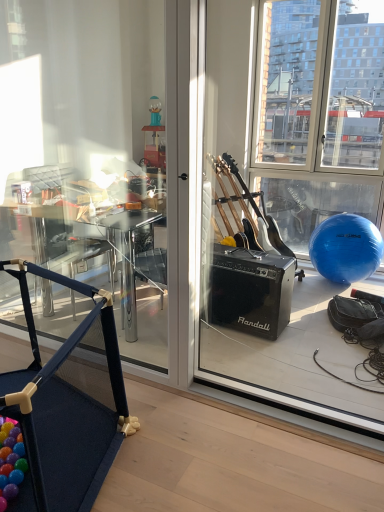
Question: Can you confirm if transparent glass window screen at right is smaller than blue fabric playpen at lower left?

Choices:
 (A) no
 (B) yes

Answer: (B)

Question: Is transparent glass window screen at right oriented towards blue fabric playpen at lower left?

Choices:
 (A) no
 (B) yes

Answer: (A)

Question: From a real-world perspective, does transparent glass window screen at right stand above blue fabric playpen at lower left?

Choices:
 (A) no
 (B) yes

Answer: (B)

Question: From the image's perspective, would you say transparent glass window screen at right is positioned over blue fabric playpen at lower left?

Choices:
 (A) yes
 (B) no

Answer: (A)

Question: Is transparent glass window screen at right positioned with its back to blue fabric playpen at lower left?

Choices:
 (A) yes
 (B) no

Answer: (B)

Question: Is point (82, 370) positioned closer to the camera than point (39, 397)?

Choices:
 (A) closer
 (B) farther

Answer: (B)

Question: From the image's perspective, is wooden floor at lower left positioned above or below blue fabric playpen at lower left?

Choices:
 (A) below
 (B) above

Answer: (A)

Question: In terms of height, does wooden floor at lower left look taller or shorter compared to blue fabric playpen at lower left?

Choices:
 (A) short
 (B) tall

Answer: (A)

Question: In terms of width, does wooden floor at lower left look wider or thinner when compared to blue fabric playpen at lower left?

Choices:
 (A) thin
 (B) wide

Answer: (B)

Question: In the image, is wooden floor at lower left positioned in front of or behind transparent glass window screen at right?

Choices:
 (A) front
 (B) behind

Answer: (A)

Question: Based on their sizes in the image, would you say wooden floor at lower left is bigger or smaller than transparent glass window screen at right?

Choices:
 (A) big
 (B) small

Answer: (B)

Question: Is wooden floor at lower left situated inside transparent glass window screen at right or outside?

Choices:
 (A) outside
 (B) inside

Answer: (A)

Question: Looking at their shapes, would you say wooden floor at lower left is wider or thinner than transparent glass window screen at right?

Choices:
 (A) wide
 (B) thin

Answer: (A)

Question: Based on their sizes in the image, would you say blue fabric playpen at lower left is bigger or smaller than transparent glass window screen at right?

Choices:
 (A) big
 (B) small

Answer: (A)

Question: Looking at their shapes, would you say blue fabric playpen at lower left is wider or thinner than transparent glass window screen at right?

Choices:
 (A) thin
 (B) wide

Answer: (B)